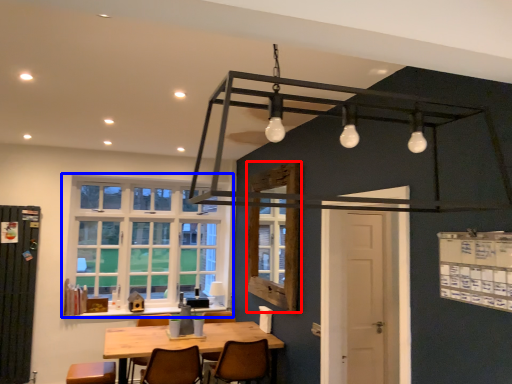
Question: Which point is closer to the camera, window (highlighted by a red box) or window (highlighted by a blue box)?

Choices:
 (A) window
 (B) window

Answer: (A)